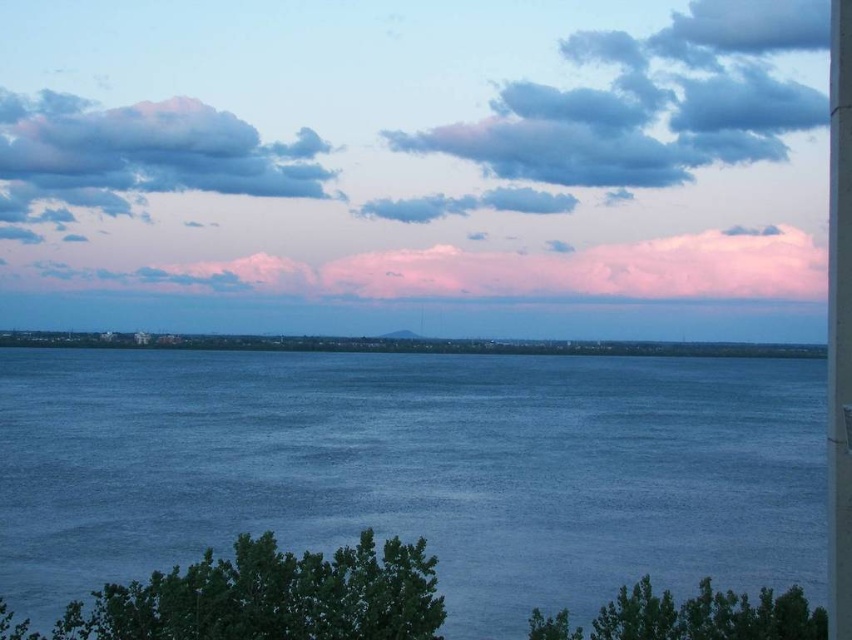
Based on the photo, you are an artist trying to paint this scene. You want to ensure the blue water at center and the pink fluffy cloud at upper center are proportionally accurate. Which object should you make wider in your painting?

The pink fluffy cloud at upper center should be wider than the blue water at center because the blue water at center has a smaller width compared to the pink fluffy cloud at upper center.

You are an airplane pilot flying over the serene landscape. You notice the blue water at center and the pink fluffy cloud at upper center. Which object would block your view if you look straight ahead?

The blue water at center would block your view first because it is in front of the pink fluffy cloud at upper center.

You are an artist trying to paint this landscape. You want to ensure the pink cotton clouds at upper center and blue water at center are positioned correctly. Which object should you paint first to maintain depth perception?

You should paint the pink cotton clouds at upper center first because they are closer to the viewer than the blue water at center, so painting them over the water will create the illusion of depth.